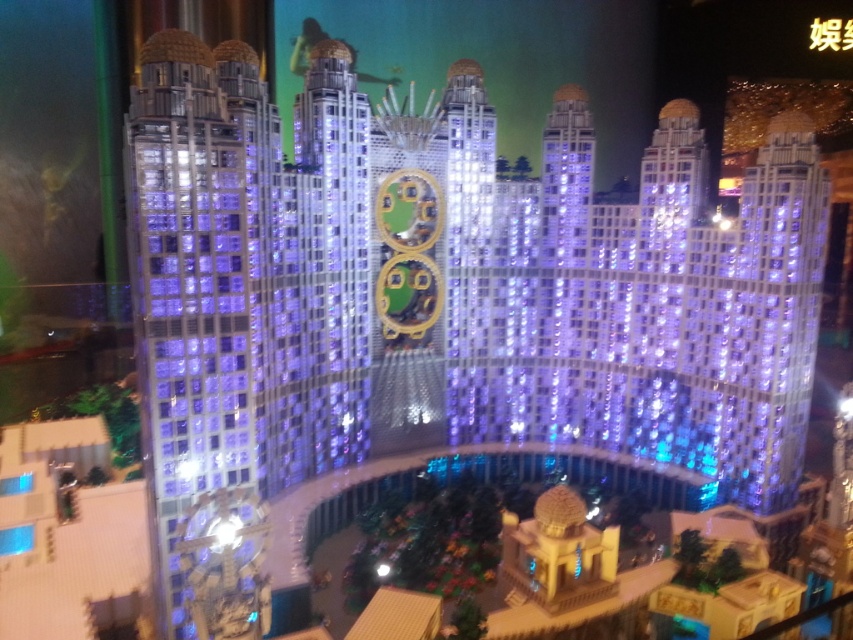
Is transparent glass tower at left to the right of lustrous glass skyscraper at right from the viewer's perspective?

Incorrect, transparent glass tower at left is not on the right side of lustrous glass skyscraper at right.

Can you confirm if transparent glass tower at left is thinner than lustrous glass skyscraper at right?

No, transparent glass tower at left is not thinner than lustrous glass skyscraper at right.

Who is more distant from viewer, [218,221] or [769,205]?

The point [769,205] is behind.

You are a GUI agent. You are given a task and a screenshot of the screen. Output one action in this format:
    pyautogui.click(x=<x>, y=<y>)
    Task: Click on the transparent glass tower at left
    
    Given the screenshot: What is the action you would take?
    pyautogui.click(x=192, y=280)

Is transparent glass tower at left thinner than shiny metallic building at center?

Incorrect, transparent glass tower at left's width is not less than shiny metallic building at center's.

What do you see at coordinates (192, 280) in the screenshot?
I see `transparent glass tower at left` at bounding box center [192, 280].

This screenshot has height=640, width=853. I want to click on transparent glass tower at left, so click(x=192, y=280).

Who is more distant from viewer, (811, 268) or (323, 305)?

The point (323, 305) is more distant.

Between lustrous glass skyscraper at right and shiny metallic building at center, which one has less height?

With less height is shiny metallic building at center.

Is point (758, 212) positioned in front of point (328, 84)?

No, (758, 212) is behind (328, 84).

You are a GUI agent. You are given a task and a screenshot of the screen. Output one action in this format:
    pyautogui.click(x=<x>, y=<y>)
    Task: Click on the lustrous glass skyscraper at right
    This screenshot has width=853, height=640.
    Given the screenshot: What is the action you would take?
    pyautogui.click(x=776, y=310)